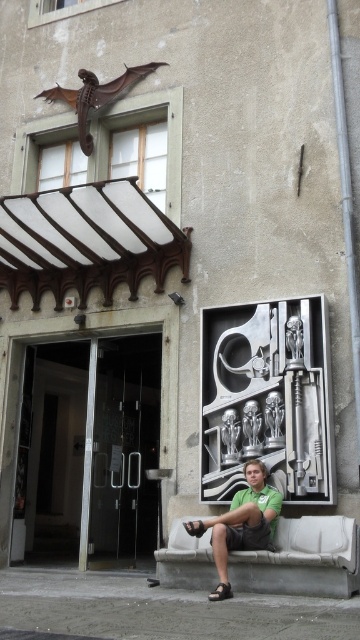
Is point (204, 568) positioned in front of point (271, 547)?

That is False.

Is point (321, 580) more distant than point (267, 520)?

No, it is not.

Between point (299, 525) and point (245, 513), which one is positioned behind?

Point (299, 525)

Identify the location of white concrete bench at lower right. The height and width of the screenshot is (640, 360). (303, 560).